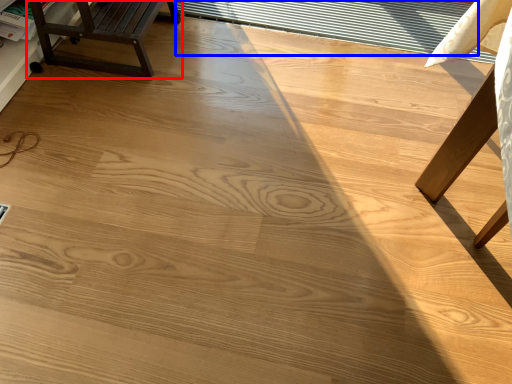
Question: Which object appears closest to the camera in this image, furniture (highlighted by a red box) or window (highlighted by a blue box)?

Choices:
 (A) furniture
 (B) window

Answer: (A)